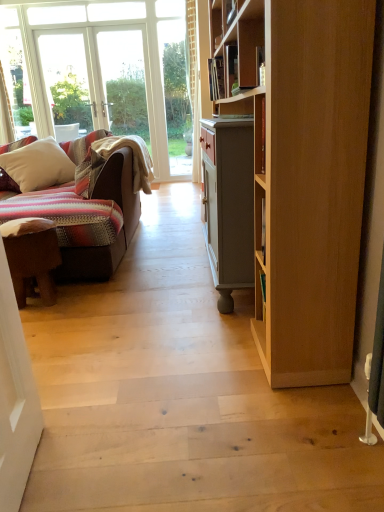
This screenshot has width=384, height=512. What do you see at coordinates (35, 167) in the screenshot?
I see `white soft pillow at left` at bounding box center [35, 167].

Image resolution: width=384 pixels, height=512 pixels. I want to click on white soft pillow at left, so click(x=35, y=167).

The width and height of the screenshot is (384, 512). Describe the element at coordinates (31, 256) in the screenshot. I see `brown leather stool at left` at that location.

You are a GUI agent. You are given a task and a screenshot of the screen. Output one action in this format:
    pyautogui.click(x=<x>, y=<y>)
    Task: Click on the brown leather stool at left
    
    Given the screenshot: What is the action you would take?
    [31, 256]

Locate an element on the screen. white soft pillow at left is located at coordinates (35, 167).

Is white soft pillow at left to the right of brown leather stool at left from the viewer's perspective?

No.

Is the depth of white soft pillow at left greater than that of brown leather stool at left?

Yes, white soft pillow at left is further from the viewer.

Which is less distant, (15, 185) or (41, 241)?

Point (41, 241)

From the image's perspective, between white soft pillow at left and brown leather stool at left, which one is located above?

white soft pillow at left appears higher in the image.

From a real-world perspective, relative to brown leather stool at left, is white soft pillow at left vertically above or below?

white soft pillow at left is situated higher than brown leather stool at left in the real world.

Considering the sizes of white soft pillow at left and brown leather stool at left in the image, is white soft pillow at left wider or thinner than brown leather stool at left?

white soft pillow at left is wider than brown leather stool at left.

Does white soft pillow at left have a greater height compared to brown leather stool at left?

Indeed, white soft pillow at left has a greater height compared to brown leather stool at left.

Which of these two, white soft pillow at left or brown leather stool at left, is bigger?

With larger size is white soft pillow at left.

Is white soft pillow at left spatially inside brown leather stool at left, or outside of it?

white soft pillow at left lies outside brown leather stool at left.

Is white soft pillow at left placed right next to brown leather stool at left?

white soft pillow at left and brown leather stool at left are clearly separated.

Could you tell me if white soft pillow at left is turned towards brown leather stool at left?

Yes, white soft pillow at left is turned towards brown leather stool at left.

In the image, there is a brown leather stool at left. Identify the location of pillow above it (from the image's perspective). The width and height of the screenshot is (384, 512). (35, 167).

Is brown leather stool at left to the left of white soft pillow at left from the viewer's perspective?

In fact, brown leather stool at left is to the right of white soft pillow at left.

Looking at this image, which object is closer to the camera taking this photo, brown leather stool at left or white soft pillow at left?

brown leather stool at left is closer to the camera.

Considering the positions of point (22, 242) and point (72, 163), is point (22, 242) closer or farther from the camera than point (72, 163)?

Point (22, 242) is closer to the camera than point (72, 163).

From the image's perspective, who appears lower, brown leather stool at left or white soft pillow at left?

brown leather stool at left, from the image's perspective.

Consider the image. From a real-world perspective, is brown leather stool at left on top of white soft pillow at left?

Incorrect, from a real-world perspective, brown leather stool at left is lower than white soft pillow at left.

Does brown leather stool at left have a lesser width compared to white soft pillow at left?

Correct, the width of brown leather stool at left is less than that of white soft pillow at left.

Is brown leather stool at left shorter than white soft pillow at left?

Indeed, brown leather stool at left has a lesser height compared to white soft pillow at left.

Considering the sizes of brown leather stool at left and white soft pillow at left in the image, is brown leather stool at left bigger or smaller than white soft pillow at left?

Clearly, brown leather stool at left is smaller in size than white soft pillow at left.

Can white soft pillow at left be found inside brown leather stool at left?

No, white soft pillow at left is not a part of brown leather stool at left.

Are brown leather stool at left and white soft pillow at left beside each other?

There is a gap between brown leather stool at left and white soft pillow at left.

Is brown leather stool at left turned away from white soft pillow at left?

Yes, brown leather stool at left's orientation is away from white soft pillow at left.

How far apart are brown leather stool at left and white soft pillow at left?

brown leather stool at left and white soft pillow at left are 5.06 feet apart from each other.

This screenshot has height=512, width=384. I want to click on pillow above the brown leather stool at left (from a real-world perspective), so click(x=35, y=167).

The height and width of the screenshot is (512, 384). I want to click on pillow on the left of brown leather stool at left, so click(35, 167).

In order to click on desk that appears below the white soft pillow at left (from a real-world perspective) in this screenshot , I will do `click(31, 256)`.